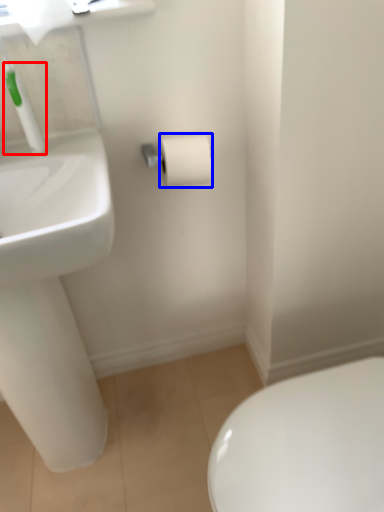
Question: Which of the following is the closest to the observer, plumbing fixture (highlighted by a red box) or toilet paper (highlighted by a blue box)?

Choices:
 (A) plumbing fixture
 (B) toilet paper

Answer: (A)